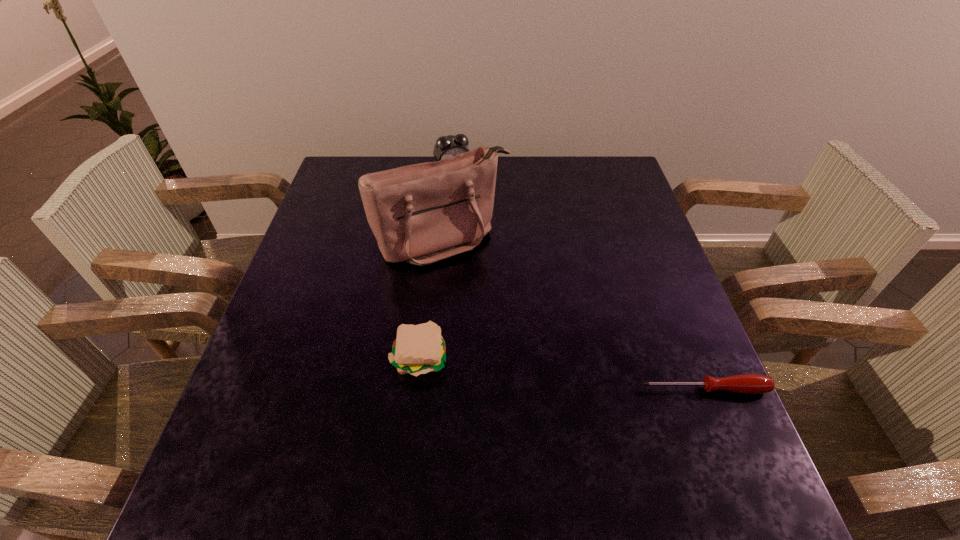
Where is `vacant area located on the front pocket of the shoulder bag`? Image resolution: width=960 pixels, height=540 pixels. vacant area located on the front pocket of the shoulder bag is located at coordinates [528, 344].

Image resolution: width=960 pixels, height=540 pixels. I want to click on blank space located 0.140m on the front side of the third shortest object, so click(x=474, y=206).

Where is `free region located on the front side of the third shortest object`? This screenshot has width=960, height=540. free region located on the front side of the third shortest object is located at coordinates (470, 200).

Identify the location of free space located 0.050m on the front side of the third shortest object. (465, 190).

The image size is (960, 540). I want to click on object that is at the far edge, so click(448, 146).

Where is `object at the right edge`? This screenshot has width=960, height=540. object at the right edge is located at coordinates (749, 383).

The width and height of the screenshot is (960, 540). In the image, there is a desktop. What are the coordinates of `vacant space at the far edge` in the screenshot? It's located at (554, 163).

You are a GUI agent. You are given a task and a screenshot of the screen. Output one action in this format:
    pyautogui.click(x=<x>, y=<y>)
    Task: Click on the vacant area at the near edge of the desktop
    This screenshot has width=960, height=540.
    Given the screenshot: What is the action you would take?
    pyautogui.click(x=633, y=408)

Image resolution: width=960 pixels, height=540 pixels. Identify the location of vacant area at the left edge. (320, 282).

The image size is (960, 540). I want to click on free space at the right edge of the desktop, so click(x=644, y=326).